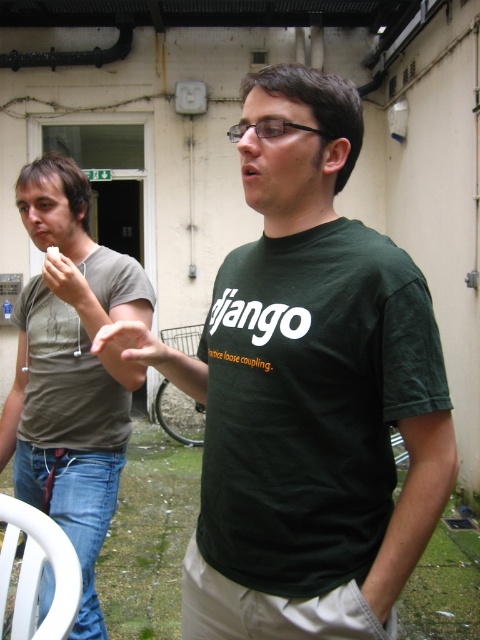
Looking at this image, is matte gray t-shirt at left shorter than white matte remote control at left?

Incorrect, matte gray t-shirt at left's height does not fall short of white matte remote control at left's.

How much distance is there between matte gray t-shirt at left and white matte remote control at left?

matte gray t-shirt at left and white matte remote control at left are 15.12 inches apart from each other.

At what (x,y) coordinates should I click in order to perform the action: click on matte gray t-shirt at left. Please return your answer as a coordinate pair (x, y). Looking at the image, I should click on (71, 371).

Can you confirm if dark green t-shirt at center is taller than matte skin hand at center?

Yes, dark green t-shirt at center is taller than matte skin hand at center.

Between dark green t-shirt at center and matte skin hand at center, which one has less height?

With less height is matte skin hand at center.

Looking at this image, who is more distant from viewer, (368, 308) or (96, 342)?

Point (96, 342)

Find the location of a particular element. dark green t-shirt at center is located at coordinates click(x=311, y=392).

Which is above, matte gray t-shirt at left or matte skin hand at center?

matte skin hand at center

Is matte gray t-shirt at left taller than matte skin hand at center?

Yes, matte gray t-shirt at left is taller than matte skin hand at center.

The width and height of the screenshot is (480, 640). Identify the location of matte gray t-shirt at left. (71, 371).